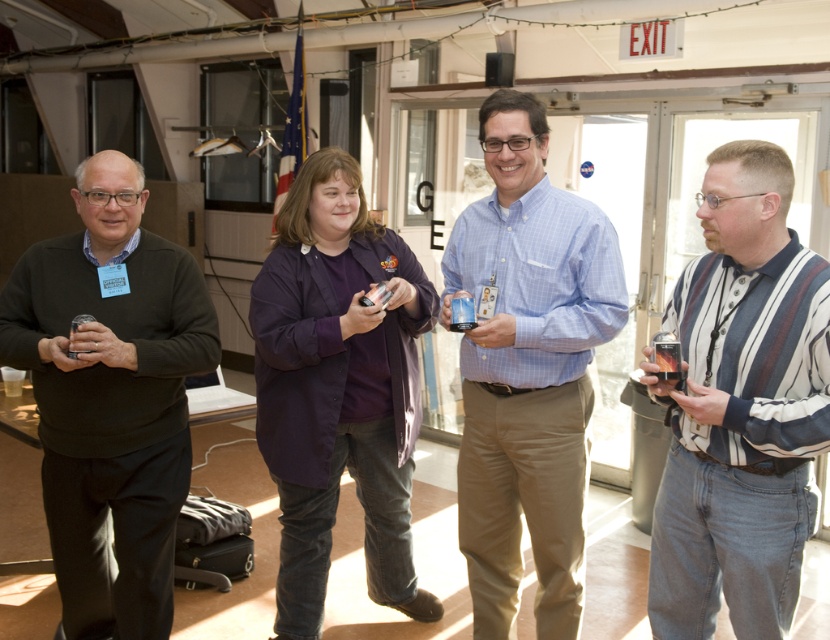
Question: Estimate the real-world distances between objects in this image. Which object is closer to the striped cotton shirt at right?

Choices:
 (A) blue checkered shirt at center
 (B) dark gray sweater at left

Answer: (A)

Question: Does dark gray sweater at left have a greater width compared to blue checkered shirt at center?

Choices:
 (A) yes
 (B) no

Answer: (A)

Question: Which point is farther to the camera?

Choices:
 (A) dark gray sweater at left
 (B) blue checkered shirt at center

Answer: (B)

Question: Can you confirm if striped cotton shirt at right is smaller than blue checkered shirt at center?

Choices:
 (A) no
 (B) yes

Answer: (B)

Question: Considering the real-world distances, which object is closest to the dark gray sweater at left?

Choices:
 (A) blue checkered shirt at center
 (B) striped cotton shirt at right

Answer: (A)

Question: Is striped cotton shirt at right positioned in front of dark gray sweater at left?

Choices:
 (A) no
 (B) yes

Answer: (B)